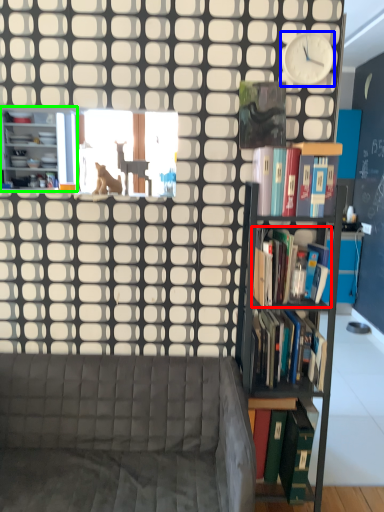
Question: Which is farther away from book (highlighted by a red box)? clock (highlighted by a blue box) or bookcase (highlighted by a green box)?

Choices:
 (A) clock
 (B) bookcase

Answer: (B)